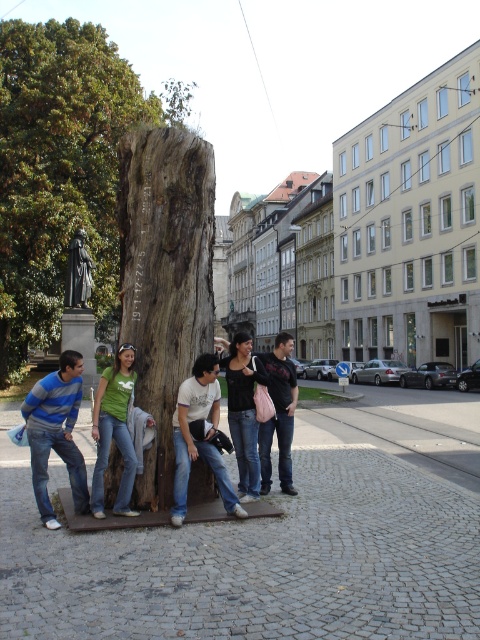
Question: Considering the relative positions of black matte shirt at center and dark gray jeans at center in the image provided, where is black matte shirt at center located with respect to dark gray jeans at center?

Choices:
 (A) above
 (B) below

Answer: (B)

Question: From the image, what is the correct spatial relationship of wooden tree trunk at center in relation to striped sweater at left?

Choices:
 (A) below
 (B) above

Answer: (B)

Question: Is striped sweater at left bigger than dark gray jeans at center?

Choices:
 (A) no
 (B) yes

Answer: (B)

Question: Which point is closer to the camera taking this photo?

Choices:
 (A) (99, 480)
 (B) (292, 376)
 (C) (226, 472)

Answer: (C)

Question: Which of the following is the farthest from the observer?

Choices:
 (A) white cotton t-shirt at center
 (B) striped sweater at left

Answer: (A)

Question: Among these points, which one is nearest to the camera?

Choices:
 (A) pos(252,480)
 (B) pos(123,452)
 (C) pos(291,381)

Answer: (B)